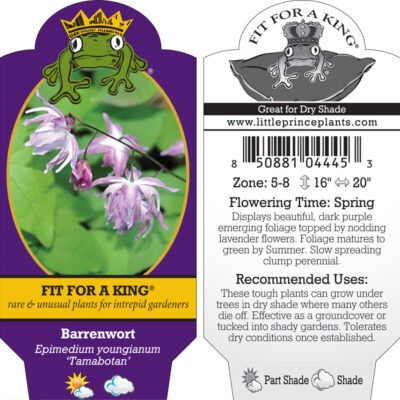
Where is `pillow`? The height and width of the screenshot is (400, 400). pillow is located at coordinates (342, 77).